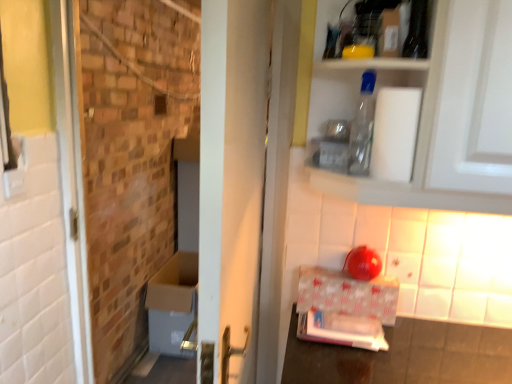
Find the location of a particular element. This screenshot has width=512, height=384. transparent plastic bottle at upper center is located at coordinates (362, 127).

The height and width of the screenshot is (384, 512). I want to click on brickwork at left, so click(132, 159).

This screenshot has width=512, height=384. I want to click on transparent plastic bottle at upper center, so click(x=362, y=127).

Consider the image. From a real-world perspective, is white matte toilet paper at upper right physically above brickwork at left?

Yes.

How different are the orientations of white matte toilet paper at upper right and brickwork at left in degrees?

white matte toilet paper at upper right and brickwork at left are facing 0.562 degrees away from each other.

Does white matte toilet paper at upper right turn towards brickwork at left?

No, white matte toilet paper at upper right does not turn towards brickwork at left.

Between white matte toilet paper at upper right and transparent plastic bottle at upper center, which one has larger width?

With larger width is white matte toilet paper at upper right.

Is white matte toilet paper at upper right not close to transparent plastic bottle at upper center?

Actually, white matte toilet paper at upper right and transparent plastic bottle at upper center are a little close together.

This screenshot has width=512, height=384. I want to click on toilet paper that is in front of the transparent plastic bottle at upper center, so click(395, 133).

Is white matte toilet paper at upper right to the left or to the right of transparent plastic bottle at upper center in the image?

Clearly, white matte toilet paper at upper right is on the right of transparent plastic bottle at upper center in the image.

Looking at this image, can you confirm if brickwork at left is smaller than white matte toilet paper at upper right?

No.

From a real-world perspective, is brickwork at left located beneath white matte toilet paper at upper right?

Correct, in the physical world, brickwork at left is lower than white matte toilet paper at upper right.

Is white matte toilet paper at upper right at the back of brickwork at left?

No.

Is brickwork at left outside of white matte toilet paper at upper right?

Yes.

Looking at the image, does white matte toilet paper at upper right seem bigger or smaller compared to white glossy door at center?

Considering their sizes, white matte toilet paper at upper right takes up less space than white glossy door at center.

Is white matte toilet paper at upper right far away from white glossy door at center?

No, white matte toilet paper at upper right is not far away from white glossy door at center.

From the image's perspective, is white matte toilet paper at upper right above white glossy door at center?

Yes, from the image's perspective, white matte toilet paper at upper right is on top of white glossy door at center.

Is brickwork at left bigger or smaller than white glossy door at center?

brickwork at left is bigger than white glossy door at center.

Is brickwork at left situated inside white glossy door at center or outside?

→ brickwork at left is outside white glossy door at center.

How different are the orientations of brickwork at left and white glossy door at center in degrees?

88.7 degrees separate the facing orientations of brickwork at left and white glossy door at center.

From the image's perspective, which is below, brickwork at left or white glossy door at center?

white glossy door at center is shown below in the image.

Is point (364, 84) closer to viewer compared to point (246, 24)?

No, it is behind (246, 24).

What's the angular difference between transparent plastic bottle at upper center and white glossy door at center's facing directions?

There is a 89.3-degree angle between the facing directions of transparent plastic bottle at upper center and white glossy door at center.

Considering the sizes of objects transparent plastic bottle at upper center and white glossy door at center in the image provided, who is taller, transparent plastic bottle at upper center or white glossy door at center?

white glossy door at center is taller.

In the image, is transparent plastic bottle at upper center on the left side or the right side of white glossy door at center?

From the image, it's evident that transparent plastic bottle at upper center is to the right of white glossy door at center.

Is transparent plastic bottle at upper center at the back of brickwork at left?

No, transparent plastic bottle at upper center is not at the back of brickwork at left.

Is brickwork at left not within transparent plastic bottle at upper center?

That's correct, brickwork at left is outside of transparent plastic bottle at upper center.

Considering the relative sizes of brickwork at left and transparent plastic bottle at upper center in the image provided, is brickwork at left smaller than transparent plastic bottle at upper center?

Actually, brickwork at left might be larger than transparent plastic bottle at upper center.

The width and height of the screenshot is (512, 384). Find the location of `toilet paper on the right of brickwork at left`. toilet paper on the right of brickwork at left is located at coordinates (395, 133).

At what (x,y) coordinates should I click in order to perform the action: click on toilet paper below the transparent plastic bottle at upper center (from a real-world perspective). Please return your answer as a coordinate pair (x, y). Image resolution: width=512 pixels, height=384 pixels. Looking at the image, I should click on (395, 133).

When comparing their distances from white glossy door at center, does white glossy cardboard box at lower right or white matte toilet paper at upper right seem closer?

white glossy cardboard box at lower right.

When comparing their distances from brickwork at left, does white glossy cardboard box at lower right or white matte toilet paper at upper right seem further?

white matte toilet paper at upper right lies further to brickwork at left than the other object.

Looking at the image, which one is located further to transparent plastic bottle at upper center, white matte toilet paper at upper right or white glossy cardboard box at lower right?

The object further to transparent plastic bottle at upper center is white glossy cardboard box at lower right.

Which object lies nearer to the anchor point brickwork at left, white matte toilet paper at upper right or white glossy door at center?

white glossy door at center.

Which object lies nearer to the anchor point brickwork at left, white matte toilet paper at upper right or white glossy cardboard box at lower right?

white glossy cardboard box at lower right is positioned closer to the anchor brickwork at left.

Estimate the real-world distances between objects in this image. Which object is closer to white glossy door at center, white matte toilet paper at upper right or transparent plastic bottle at upper center?

transparent plastic bottle at upper center is closer to white glossy door at center.

Consider the image. When comparing their distances from white glossy door at center, does white matte toilet paper at upper right or brickwork at left seem further?

The object further to white glossy door at center is brickwork at left.

Estimate the real-world distances between objects in this image. Which object is further from transparent plastic bottle at upper center, white glossy door at center or white glossy cardboard box at lower right?

Based on the image, white glossy cardboard box at lower right appears to be further to transparent plastic bottle at upper center.

This screenshot has width=512, height=384. I want to click on toilet paper located between white glossy door at center and transparent plastic bottle at upper center in the depth direction, so click(395, 133).

Find the location of a particular element. toilet paper between transparent plastic bottle at upper center and white glossy cardboard box at lower right in the vertical direction is located at coordinates (395, 133).

You are a GUI agent. You are given a task and a screenshot of the screen. Output one action in this format:
    pyautogui.click(x=<x>, y=<y>)
    Task: Click on the cardboard box between white glossy door at center and brickwork at left along the z-axis
    The height and width of the screenshot is (384, 512).
    Given the screenshot: What is the action you would take?
    pyautogui.click(x=347, y=294)

Where is `bottle between brickwork at left and white matte toilet paper at upper right from left to right`? Image resolution: width=512 pixels, height=384 pixels. bottle between brickwork at left and white matte toilet paper at upper right from left to right is located at coordinates (362, 127).